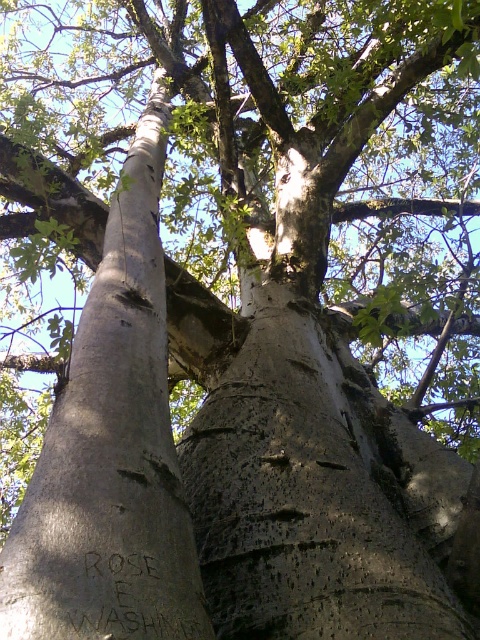
This screenshot has width=480, height=640. What do you see at coordinates (111, 451) in the screenshot?
I see `smooth gray bark at center` at bounding box center [111, 451].

Which is behind, point (103, 531) or point (195, 582)?

Point (195, 582)

Which is behind, point (103, 616) or point (178, 632)?

Point (178, 632)

Find the location of `smooth gray bark at center`. smooth gray bark at center is located at coordinates (111, 451).